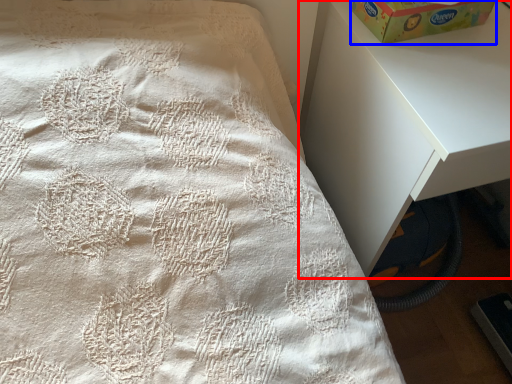
Question: Which point is closer to the camera, nightstand (highlighted by a red box) or box (highlighted by a blue box)?

Choices:
 (A) nightstand
 (B) box

Answer: (A)